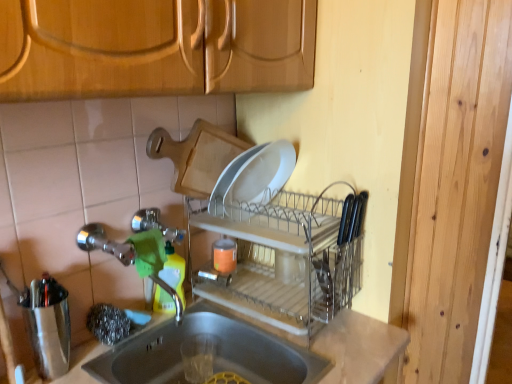
Question: Considering the positions of clear plastic dish rack at center and brushed metal shaker at left in the image, is clear plastic dish rack at center taller or shorter than brushed metal shaker at left?

Choices:
 (A) short
 (B) tall

Answer: (B)

Question: Based on their sizes in the image, would you say clear plastic dish rack at center is bigger or smaller than brushed metal shaker at left?

Choices:
 (A) small
 (B) big

Answer: (B)

Question: Based on their relative distances, which object is farther from the smooth gray sink at lower center?

Choices:
 (A) green plastic bottle at sink
 (B) clear plastic dish rack at center
 (C) brushed metal shaker at left

Answer: (C)

Question: Which is farther from the green plastic bottle at sink?

Choices:
 (A) clear plastic dish rack at center
 (B) brushed metal shaker at left
 (C) smooth gray sink at lower center

Answer: (B)